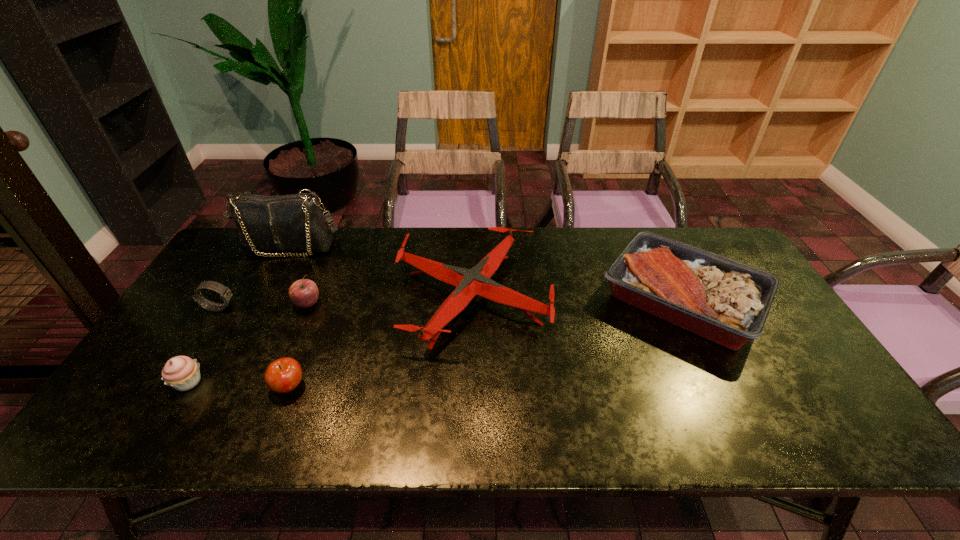
Locate an element on the screen. This screenshot has width=960, height=540. free location that satisfies the following two spatial constraints: 1. at the front of the drone with chain and zipper; 2. on the right side of the handbag is located at coordinates click(262, 298).